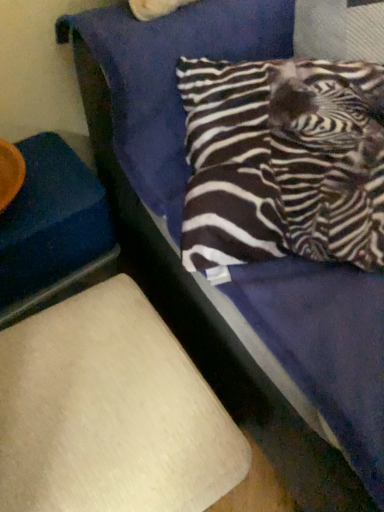
At what (x,y) coordinates should I click in order to perform the action: click on beige fabric lampshade at lower left, which ranks as the first furniture in bottom-to-top order. Please return your answer as a coordinate pair (x, y). Image resolution: width=384 pixels, height=512 pixels. Looking at the image, I should click on (110, 412).

Is blue fabric at left, which appears as the 2th furniture when ordered from the bottom, aimed at zebra-patterned fabric pillow at upper right?

No, blue fabric at left, which appears as the 2th furniture when ordered from the bottom, is not turned towards zebra-patterned fabric pillow at upper right.

Is blue fabric at left, which is counted as the 1th furniture, starting from the top, taller or shorter than zebra-patterned fabric pillow at upper right?

In the image, blue fabric at left, which is counted as the 1th furniture, starting from the top, appears to be taller than zebra-patterned fabric pillow at upper right.

Is blue fabric at left, which is counted as the 1th furniture, starting from the top, thinner than zebra-patterned fabric pillow at upper right?

Yes.

Who is smaller, beige fabric lampshade at lower left, which ranks as the first furniture in bottom-to-top order, or blue fabric at left, which appears as the 2th furniture when ordered from the bottom?

blue fabric at left, which appears as the 2th furniture when ordered from the bottom, is smaller.

How many degrees apart are the facing directions of beige fabric lampshade at lower left, which ranks as the first furniture in bottom-to-top order, and blue fabric at left, which is counted as the 1th furniture, starting from the top?

They differ by 0.59 degrees in their facing directions.

Which point is more forward, (107,386) or (56,282)?

The point (107,386) is in front.

Looking at their sizes, would you say beige fabric lampshade at lower left, the 2th furniture viewed from the top, is wider or thinner than blue fabric at left, which appears as the 2th furniture when ordered from the bottom?

beige fabric lampshade at lower left, the 2th furniture viewed from the top, is wider than blue fabric at left, which appears as the 2th furniture when ordered from the bottom.

Is zebra-patterned fabric pillow at upper right directly adjacent to beige fabric lampshade at lower left, which ranks as the first furniture in bottom-to-top order?

No, zebra-patterned fabric pillow at upper right is not in contact with beige fabric lampshade at lower left, which ranks as the first furniture in bottom-to-top order.

From the image's perspective, which is below, zebra-patterned fabric pillow at upper right or beige fabric lampshade at lower left, the 2th furniture viewed from the top?

From the image's view, beige fabric lampshade at lower left, the 2th furniture viewed from the top, is below.

Between zebra-patterned fabric pillow at upper right and beige fabric lampshade at lower left, the 2th furniture viewed from the top, which one appears on the left side from the viewer's perspective?

beige fabric lampshade at lower left, the 2th furniture viewed from the top, is more to the left.

From a real-world perspective, is zebra-patterned fabric pillow at upper right under beige fabric lampshade at lower left, which ranks as the first furniture in bottom-to-top order?

No, from a real-world perspective, zebra-patterned fabric pillow at upper right is not under beige fabric lampshade at lower left, which ranks as the first furniture in bottom-to-top order.

Considering the sizes of zebra-patterned fabric pillow at upper right and blue fabric at left, which is counted as the 1th furniture, starting from the top, in the image, is zebra-patterned fabric pillow at upper right taller or shorter than blue fabric at left, which is counted as the 1th furniture, starting from the top,?

In the image, zebra-patterned fabric pillow at upper right appears to be shorter than blue fabric at left, which is counted as the 1th furniture, starting from the top.

Is blue fabric at left, which is counted as the 1th furniture, starting from the top, at the back of zebra-patterned fabric pillow at upper right?

No, zebra-patterned fabric pillow at upper right is not facing the opposite direction of blue fabric at left, which is counted as the 1th furniture, starting from the top.

Are zebra-patterned fabric pillow at upper right and blue fabric at left, which is counted as the 1th furniture, starting from the top, located far from each other?

No, zebra-patterned fabric pillow at upper right is not far away from blue fabric at left, which is counted as the 1th furniture, starting from the top.

Consider the image. From the image's perspective, does zebra-patterned fabric pillow at upper right appear lower than blue fabric at left, which is counted as the 1th furniture, starting from the top?

No, from the image's perspective, zebra-patterned fabric pillow at upper right is not below blue fabric at left, which is counted as the 1th furniture, starting from the top.

From the image's perspective, relative to zebra-patterned fabric pillow at upper right, is beige fabric lampshade at lower left, which ranks as the first furniture in bottom-to-top order, above or below?

beige fabric lampshade at lower left, which ranks as the first furniture in bottom-to-top order, is situated lower than zebra-patterned fabric pillow at upper right in the image.

Is beige fabric lampshade at lower left, which ranks as the first furniture in bottom-to-top order, touching zebra-patterned fabric pillow at upper right?

No, beige fabric lampshade at lower left, which ranks as the first furniture in bottom-to-top order, is not beside zebra-patterned fabric pillow at upper right.

In the scene shown: What's the angular difference between beige fabric lampshade at lower left, which ranks as the first furniture in bottom-to-top order, and zebra-patterned fabric pillow at upper right's facing directions?

There is a 0.326-degree angle between the facing directions of beige fabric lampshade at lower left, which ranks as the first furniture in bottom-to-top order, and zebra-patterned fabric pillow at upper right.

Is point (143, 324) positioned after point (214, 208)?

No, (143, 324) is in front of (214, 208).

Is blue fabric at left, which is counted as the 1th furniture, starting from the top, looking in the opposite direction of beige fabric lampshade at lower left, the 2th furniture viewed from the top?

That's not correct — blue fabric at left, which is counted as the 1th furniture, starting from the top, is not looking away from beige fabric lampshade at lower left, the 2th furniture viewed from the top.

Which is farther from the camera, (21, 305) or (107, 412)?

The point (21, 305) is more distant.

Is the depth of blue fabric at left, which is counted as the 1th furniture, starting from the top, less than that of beige fabric lampshade at lower left, which ranks as the first furniture in bottom-to-top order?

No, the depth of blue fabric at left, which is counted as the 1th furniture, starting from the top, is greater than that of beige fabric lampshade at lower left, which ranks as the first furniture in bottom-to-top order.

From the image's perspective, which object appears higher, blue fabric at left, which appears as the 2th furniture when ordered from the bottom, or beige fabric lampshade at lower left, the 2th furniture viewed from the top?

blue fabric at left, which appears as the 2th furniture when ordered from the bottom, is shown above in the image.

Find the location of a particular element. Image resolution: width=384 pixels, height=512 pixels. the 2nd furniture below the zebra-patterned fabric pillow at upper right (from a real-world perspective) is located at coordinates pyautogui.click(x=53, y=231).

This screenshot has height=512, width=384. In order to click on furniture on the left side of beige fabric lampshade at lower left, the 2th furniture viewed from the top in this screenshot , I will do `click(53, 231)`.

Based on their spatial positions, is beige fabric lampshade at lower left, which ranks as the first furniture in bottom-to-top order, or blue fabric at left, which is counted as the 1th furniture, starting from the top, closer to zebra-patterned fabric pillow at upper right?

beige fabric lampshade at lower left, which ranks as the first furniture in bottom-to-top order, is positioned closer to the anchor zebra-patterned fabric pillow at upper right.

When comparing their distances from beige fabric lampshade at lower left, which ranks as the first furniture in bottom-to-top order, does zebra-patterned fabric pillow at upper right or blue fabric at left, which is counted as the 1th furniture, starting from the top, seem further?

Among the two, zebra-patterned fabric pillow at upper right is located further to beige fabric lampshade at lower left, which ranks as the first furniture in bottom-to-top order.

From the image, which object appears to be farther from blue fabric at left, which appears as the 2th furniture when ordered from the bottom, beige fabric lampshade at lower left, which ranks as the first furniture in bottom-to-top order, or zebra-patterned fabric pillow at upper right?

The object further to blue fabric at left, which appears as the 2th furniture when ordered from the bottom, is zebra-patterned fabric pillow at upper right.

Based on their spatial positions, is blue fabric at left, which appears as the 2th furniture when ordered from the bottom, or beige fabric lampshade at lower left, which ranks as the first furniture in bottom-to-top order, further from zebra-patterned fabric pillow at upper right?

blue fabric at left, which appears as the 2th furniture when ordered from the bottom, is further to zebra-patterned fabric pillow at upper right.

Which object lies nearer to the anchor point beige fabric lampshade at lower left, which ranks as the first furniture in bottom-to-top order, blue fabric at left, which appears as the 2th furniture when ordered from the bottom, or zebra-patterned fabric pillow at upper right?

blue fabric at left, which appears as the 2th furniture when ordered from the bottom, is positioned closer to the anchor beige fabric lampshade at lower left, which ranks as the first furniture in bottom-to-top order.

Considering their positions, is zebra-patterned fabric pillow at upper right positioned further to blue fabric at left, which is counted as the 1th furniture, starting from the top, than beige fabric lampshade at lower left, which ranks as the first furniture in bottom-to-top order?

Based on the image, zebra-patterned fabric pillow at upper right appears to be further to blue fabric at left, which is counted as the 1th furniture, starting from the top.

What are the coordinates of `furniture between blue fabric at left, which appears as the 2th furniture when ordered from the bottom, and zebra-patterned fabric pillow at upper right from left to right` in the screenshot? It's located at (110, 412).